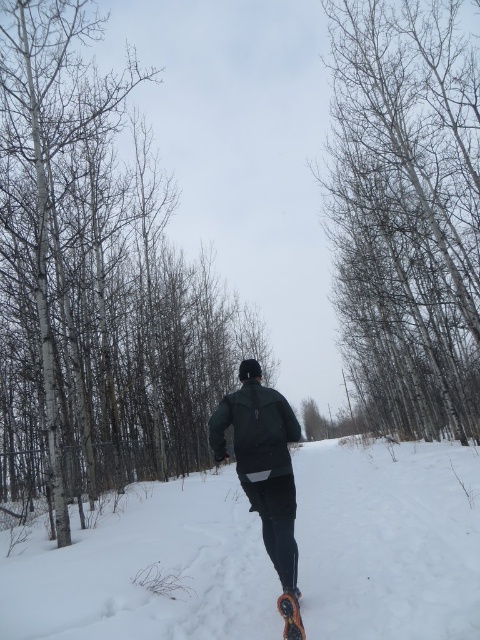
Does white fluffy snow at center have a smaller size compared to dark green fabric snowboarder at center?

Indeed, white fluffy snow at center has a smaller size compared to dark green fabric snowboarder at center.

Does point (323, 465) come in front of point (286, 460)?

No, (323, 465) is further to viewer.

The image size is (480, 640). In order to click on white fluffy snow at center in this screenshot , I will do `click(388, 540)`.

Who is positioned more to the right, white fluffy snow at center or smooth white tree at center?

smooth white tree at center is more to the right.

Describe the element at coordinates (388, 540) in the screenshot. I see `white fluffy snow at center` at that location.

Between point (420, 620) and point (395, 26), which one is positioned in front?

Point (420, 620) is in front.

Where is `white fluffy snow at center`? Image resolution: width=480 pixels, height=640 pixels. white fluffy snow at center is located at coordinates (388, 540).

In the scene shown: Does white fluffy snow at center appear under black rubber snowshoe at lower center?

Yes, white fluffy snow at center is below black rubber snowshoe at lower center.

Who is more distant from viewer, (425, 550) or (282, 608)?

Point (425, 550)

Find the location of `white fluffy snow at center`. white fluffy snow at center is located at coordinates (388, 540).